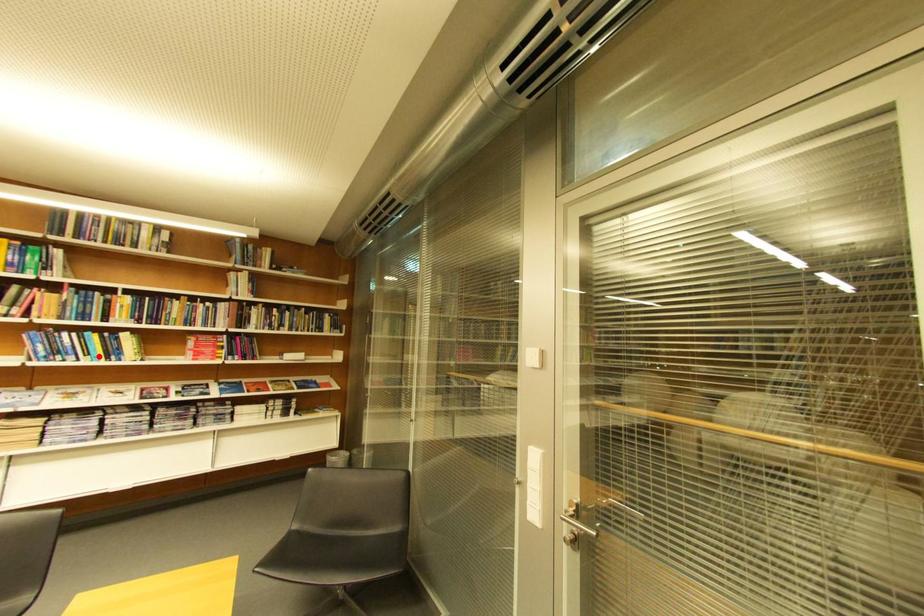
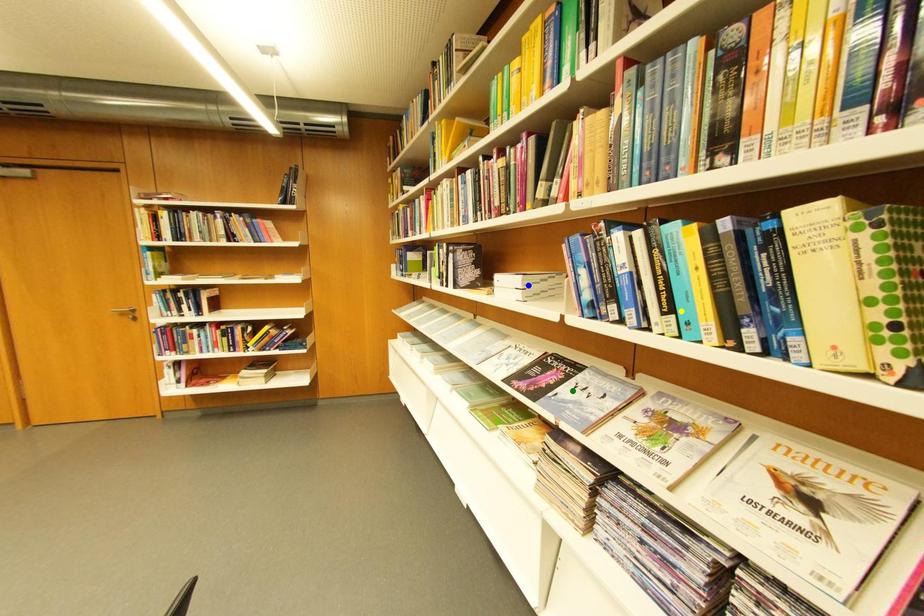
Question: I am providing you with two images of the same scene from different viewpoints. A red point is marked on the first image. You are given multiple points on the second image. Which point in image 2 represents the same 3d spot as the red point in image 1?

Choices:
 (A) blue point
 (B) green point
 (C) yellow point

Answer: (C)